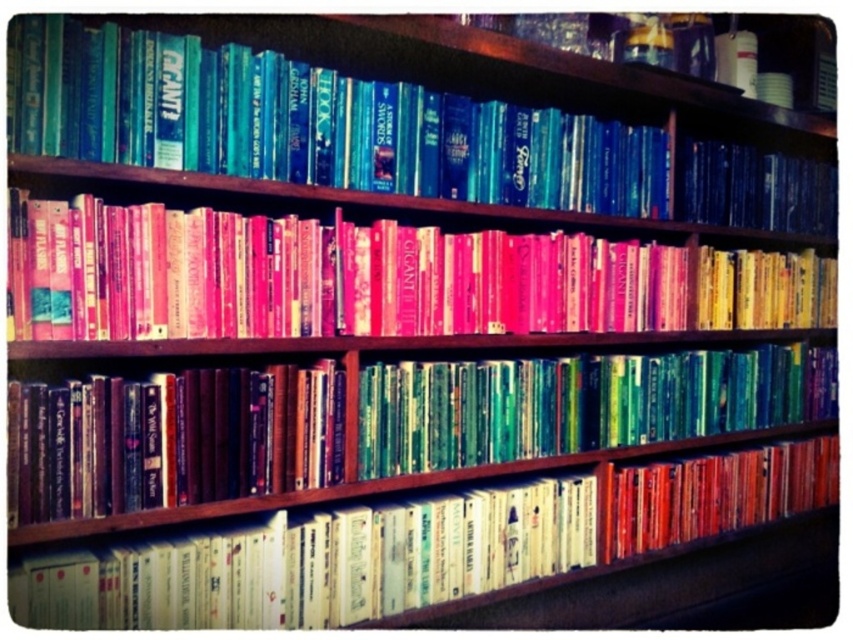
Does white matte book at lower center have a larger size compared to matte orange book at lower right?

Indeed, white matte book at lower center has a larger size compared to matte orange book at lower right.

Who is more distant from viewer, (502, 497) or (637, 536)?

Positioned behind is point (637, 536).

Identify the location of white matte book at lower center. The width and height of the screenshot is (853, 640). (318, 563).

What are the coordinates of `white matte book at lower center` in the screenshot? It's located at (318, 563).

Which of these two, matte orange book at lower right or yellow paperbacks at center, stands shorter?

matte orange book at lower right

The height and width of the screenshot is (640, 853). What do you see at coordinates (712, 493) in the screenshot? I see `matte orange book at lower right` at bounding box center [712, 493].

What do you see at coordinates (712, 493) in the screenshot?
I see `matte orange book at lower right` at bounding box center [712, 493].

Where is `matte orange book at lower right`? Image resolution: width=853 pixels, height=640 pixels. matte orange book at lower right is located at coordinates (712, 493).

Is pink matte book at center below white matte book at lower center?

No, pink matte book at center is not below white matte book at lower center.

Is point (10, 212) farther from viewer compared to point (62, 624)?

No, it is in front of (62, 624).

Identify the location of pink matte book at center. This screenshot has height=640, width=853. (373, 278).